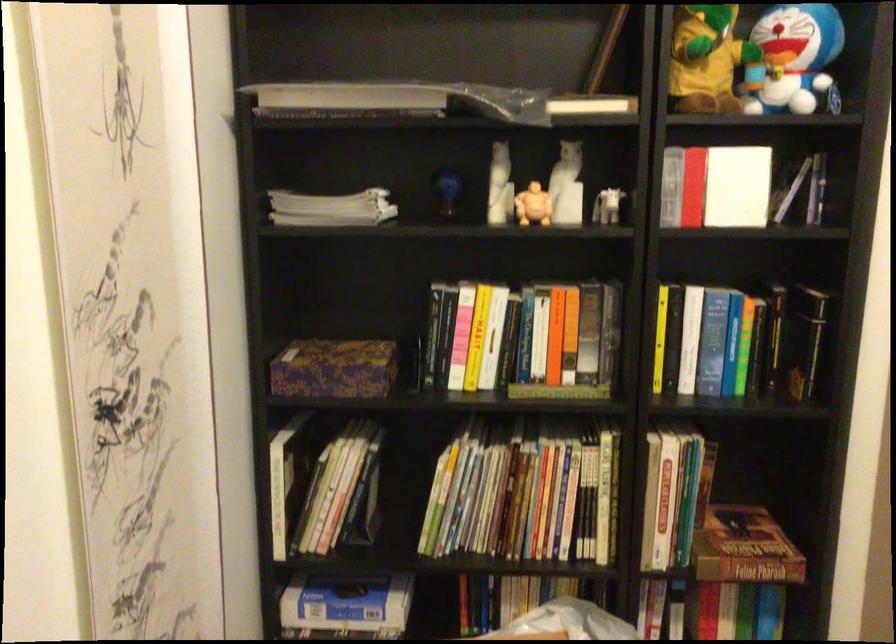
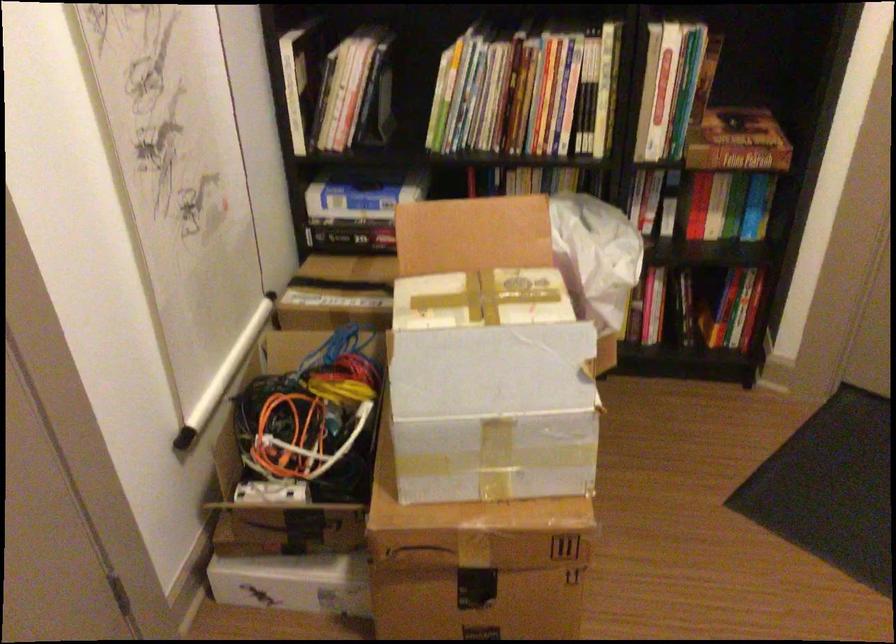
The point at (626, 572) is marked in the first image. Where is the corresponding point in the second image?

(618, 161)